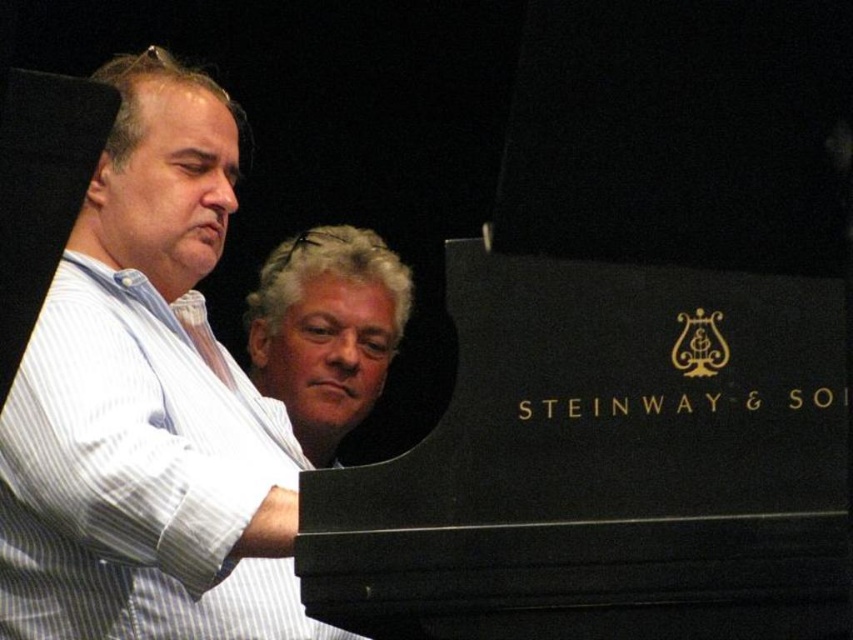
Question: Which of the following is the closest to the observer?

Choices:
 (A) (48, 401)
 (B) (756, 516)
 (C) (379, 387)

Answer: (B)

Question: Among these objects, which one is nearest to the camera?

Choices:
 (A) black polished wood piano at center
 (B) white striped shirt at left
 (C) gray hair at center

Answer: (A)

Question: Does black polished wood piano at center appear under white striped shirt at left?

Choices:
 (A) no
 (B) yes

Answer: (B)

Question: Which point is farther from the camera taking this photo?

Choices:
 (A) (496, 547)
 (B) (148, 115)

Answer: (B)

Question: Is black polished wood piano at center in front of white striped shirt at left?

Choices:
 (A) no
 (B) yes

Answer: (B)

Question: Can you confirm if white striped shirt at left is positioned below gray hair at center?

Choices:
 (A) yes
 (B) no

Answer: (B)